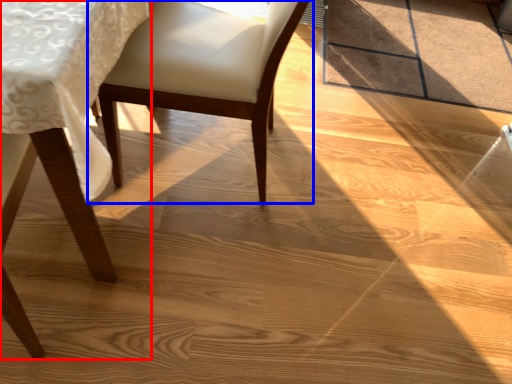
Question: Which point is closer to the camera, chair (highlighted by a red box) or chair (highlighted by a blue box)?

Choices:
 (A) chair
 (B) chair

Answer: (A)